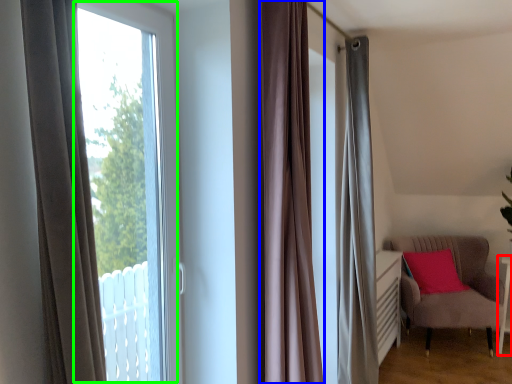
Question: Which object is the farthest from side table (highlighted by a red box)? Choose among these: curtain (highlighted by a blue box) or bay window (highlighted by a green box).

Choices:
 (A) curtain
 (B) bay window

Answer: (B)